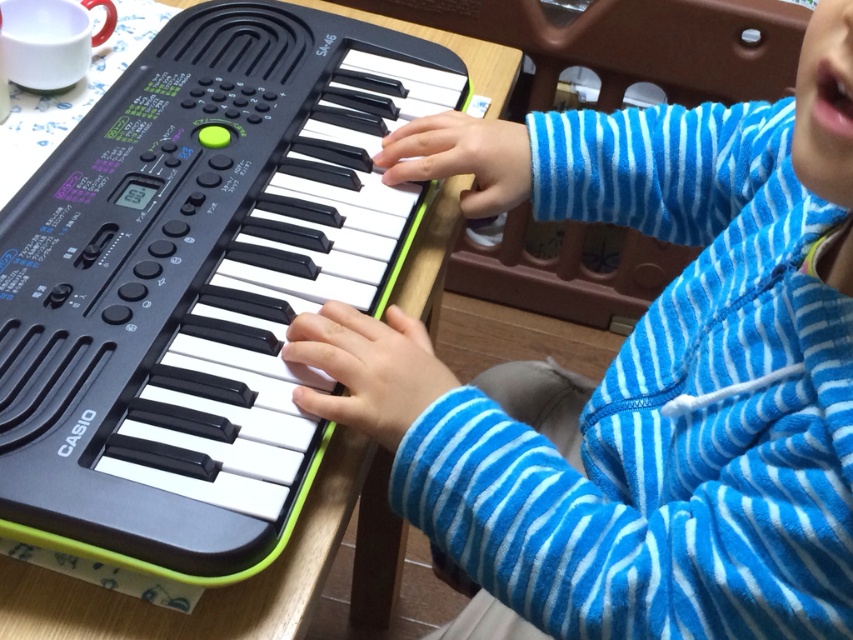
Looking at this image, is blue fleece sweater at center to the left of black plastic keyboard at center from the viewer's perspective?

Incorrect, blue fleece sweater at center is not on the left side of black plastic keyboard at center.

What are the coordinates of `blue fleece sweater at center` in the screenshot? It's located at (643, 372).